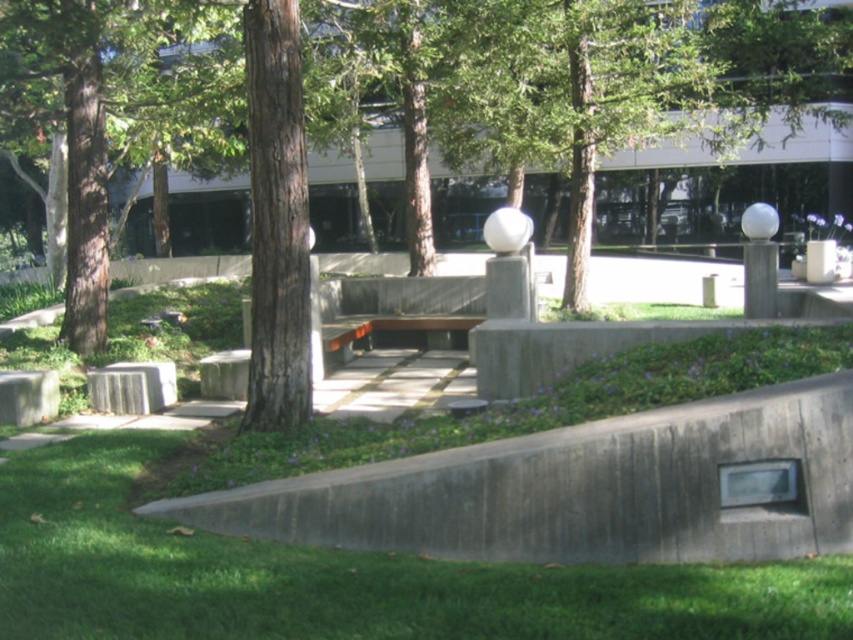
You are planning to place a new decorative statue that is 1 meter wide on the path between the green grass at lower left and the concrete bench at center. Based on the scene description, can the statue fit there without blocking the pathway?

The statue cannot be placed there because the green grass at lower left is to the left of the concrete bench at center, meaning the space between them is narrow. Since the statue is 1 meter wide, it would likely block the pathway.

You are standing on the concrete pathway in the park and see the green grass at lower left and the brown rough bark tree at center. Which object is closer to your current position?

The green grass at lower left is closer to your current position because it is located below the brown rough bark tree at center, meaning it is situated nearer to the observer standing on the pathway.

You are standing at the point marked as point (340, 576). Looking around, you see green grass at lower left. Which direction should you walk to reach the green grass at lower left?

You are already at the point where the green grass at lower left is located, so you don wait to reach it.